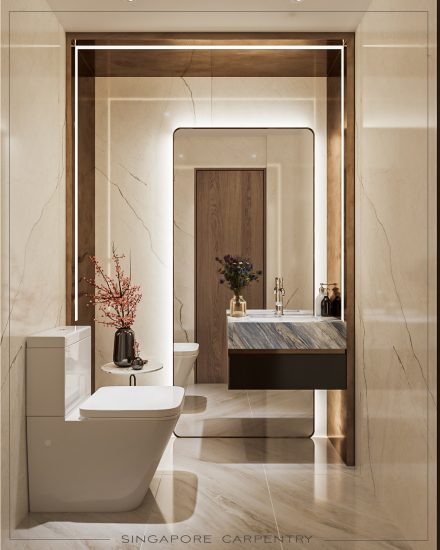
At what (x,y) coordinates should I click in order to perform the action: click on rod like lights. Please return your answer as a coordinate pair (x, y). Looking at the image, I should click on (76, 92), (200, 47), (342, 200).